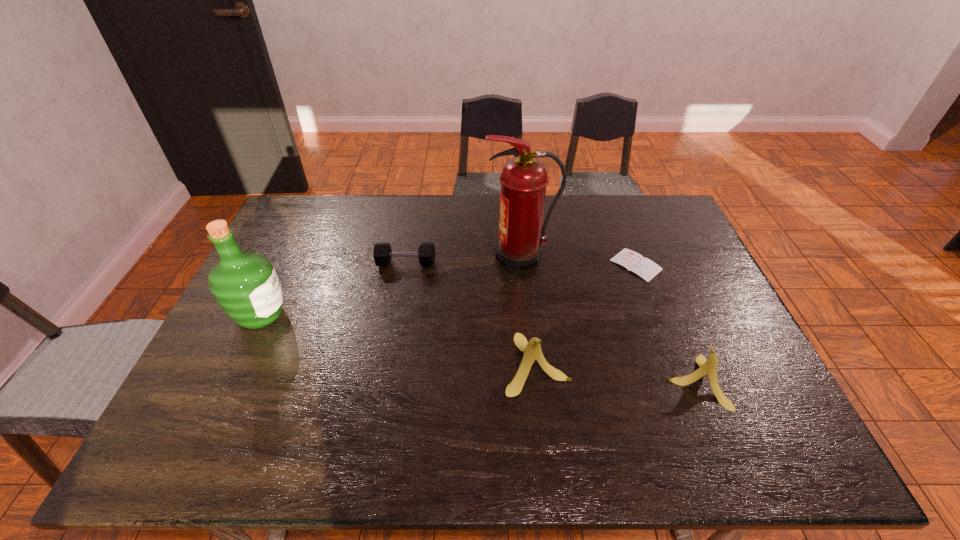
This screenshot has width=960, height=540. I want to click on free area in between the diary and the leftmost object, so click(449, 290).

In order to click on vacant space that is in between the right banana and the leftmost object in this screenshot , I will do `click(479, 349)`.

Locate an element on the screen. The image size is (960, 540). free spot between the tallest object and the left banana is located at coordinates (528, 310).

In order to click on free space between the right banana and the dumbbell in this screenshot , I will do `click(551, 323)`.

Where is `vacant area that lies between the right banana and the third tallest object`? vacant area that lies between the right banana and the third tallest object is located at coordinates (616, 373).

You are a GUI agent. You are given a task and a screenshot of the screen. Output one action in this format:
    pyautogui.click(x=<x>, y=<y>)
    Task: Click on the free space between the fifth tallest object and the fifth shortest object
    This screenshot has width=960, height=540.
    Given the screenshot: What is the action you would take?
    pyautogui.click(x=334, y=289)

Where is `vacant space that's between the shorter banana and the diary`? vacant space that's between the shorter banana and the diary is located at coordinates (666, 323).

In order to click on free space that is in between the shorter banana and the liquor in this screenshot , I will do `click(479, 349)`.

Identify the location of object that stands as the third closest to the diary. (532, 350).

Locate which object is the closest to the second shortest object. Please provide its 2D coordinates. Your answer should be formatted as a tuple, i.e. [(x, y)], where the tuple contains the x and y coordinates of a point satisfying the conditions above.

[(523, 179)]